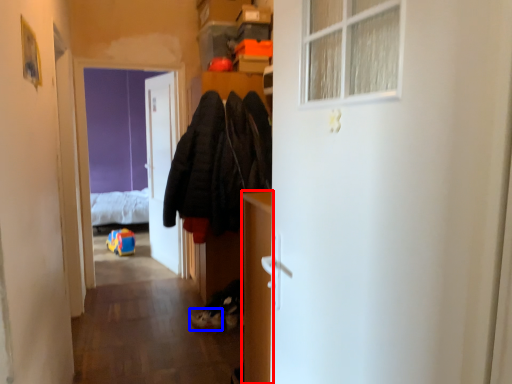
Question: Which of the following is the farthest to the observer, cabinetry (highlighted by a red box) or shoe (highlighted by a blue box)?

Choices:
 (A) cabinetry
 (B) shoe

Answer: (B)